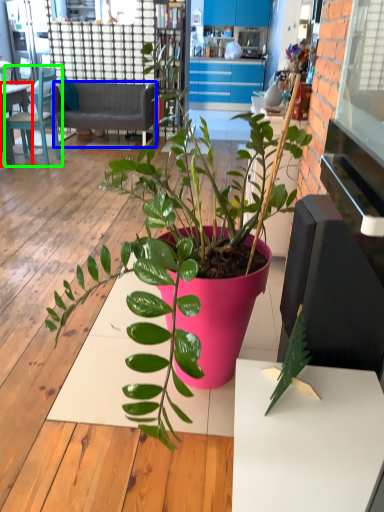
Question: Based on their relative distances, which object is farther from desk (highlighted by a red box)? Choose from studio couch (highlighted by a blue box) and chair (highlighted by a green box).

Choices:
 (A) studio couch
 (B) chair

Answer: (A)